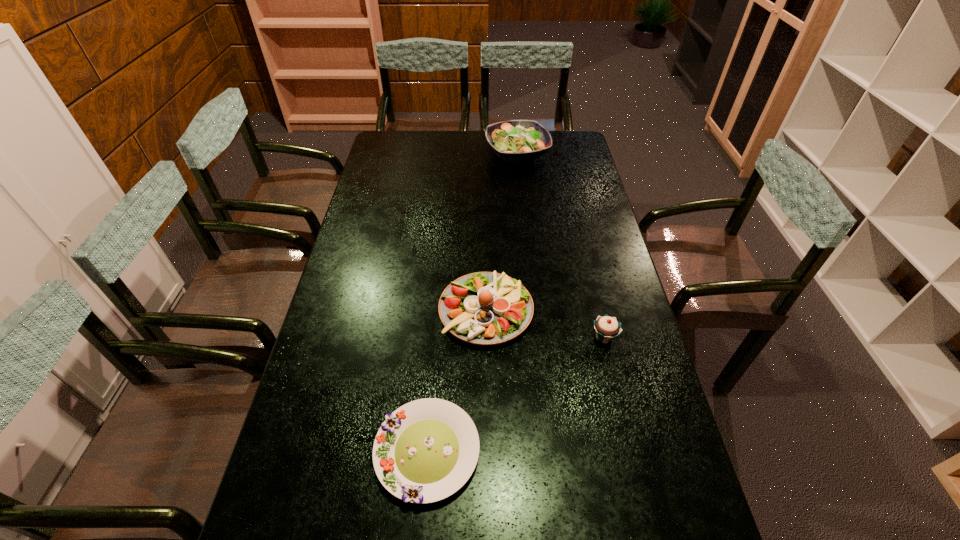
I want to click on salad plate that is the second closest one to the farthest object, so click(x=426, y=450).

Identify the location of vacant area that satisfies the following two spatial constraints: 1. on the back side of the farthest object; 2. on the right side of the nearest salad plate. This screenshot has height=540, width=960. (452, 153).